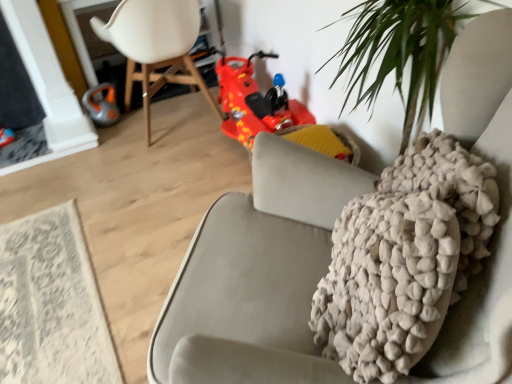
I want to click on free space in front of white plastic chair at upper left, so click(x=164, y=173).